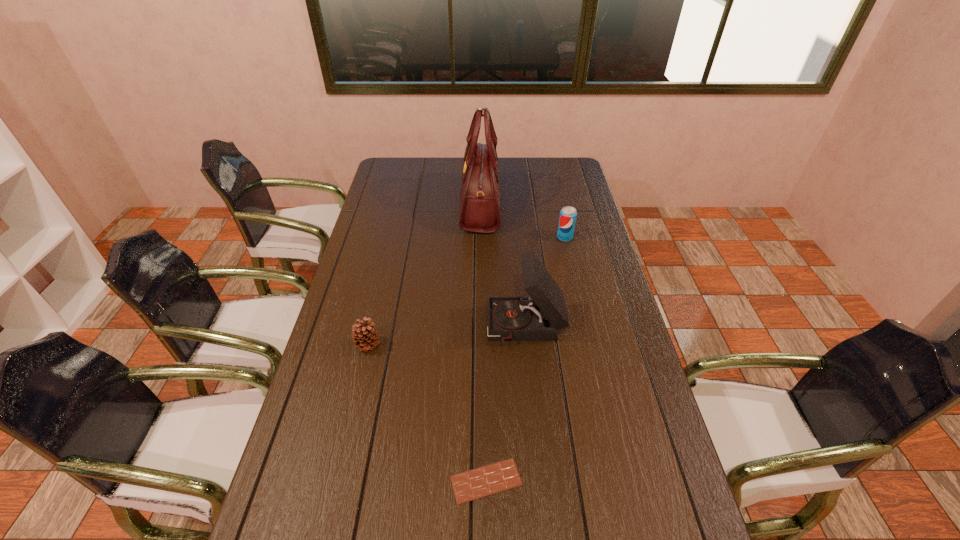
This screenshot has width=960, height=540. What are the coordinates of `vacant area in the image that satisfies the following two spatial constraints: 1. on the front-facing side of the tallest object; 2. on the back side of the chocolate bar` in the screenshot? It's located at (481, 481).